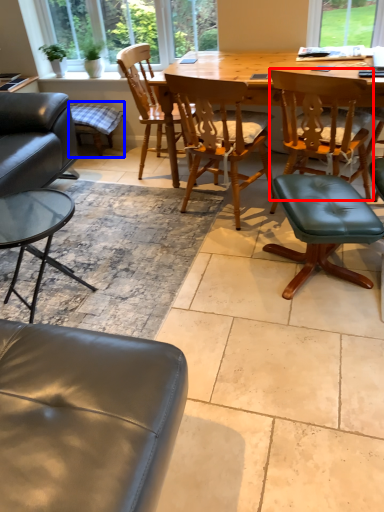
Question: Which of the following is the farthest to the observer, chair (highlighted by a red box) or bar stool (highlighted by a blue box)?

Choices:
 (A) chair
 (B) bar stool

Answer: (B)